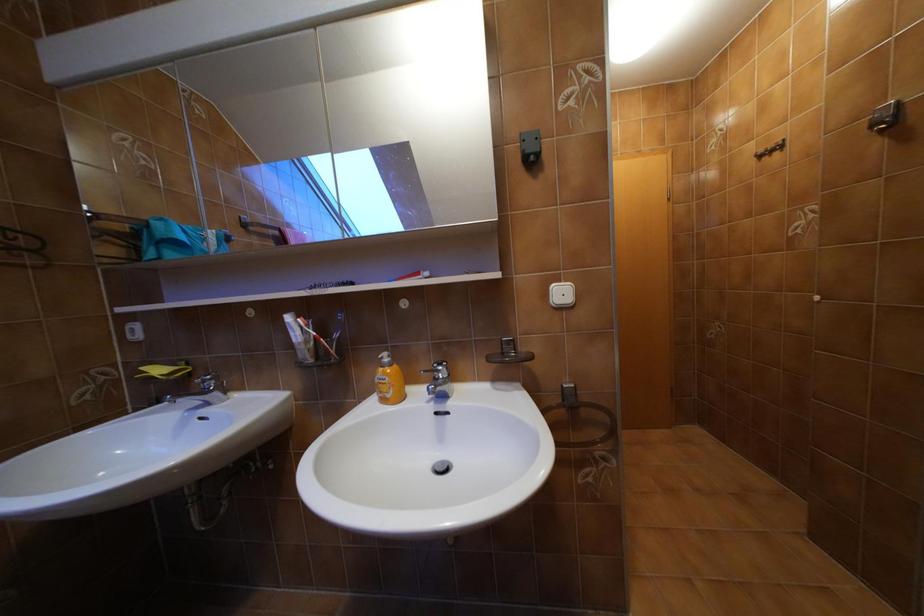
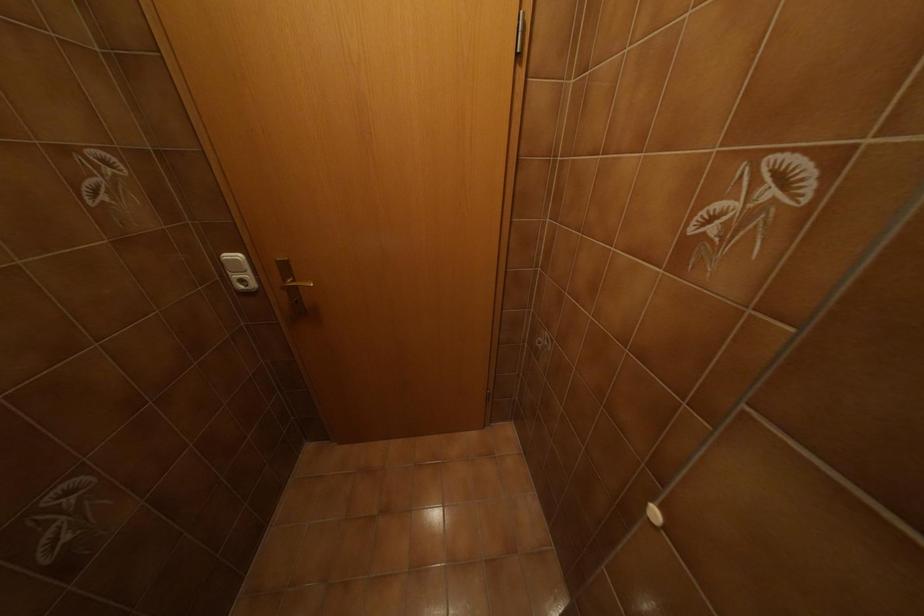
Which direction would the cameraman need to move to produce the second image?

The movement direction of the cameraman is right, forward.